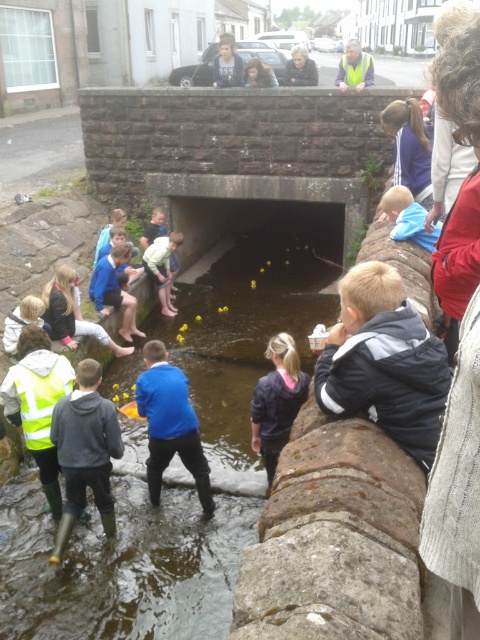
How distant is blue fabric jacket at center from yellow reflective vest at lower left?

34.67 inches

Can you confirm if blue fabric jacket at center is positioned to the left of yellow reflective vest at lower left?

In fact, blue fabric jacket at center is to the right of yellow reflective vest at lower left.

Which is in front, point (212, 500) or point (48, 396)?

Point (48, 396)

The height and width of the screenshot is (640, 480). In order to click on blue fabric jacket at center in this screenshot , I will do `click(169, 422)`.

Is yellow rubber ducks at center taller than matte black jacket at lower left?

Indeed, yellow rubber ducks at center has a greater height compared to matte black jacket at lower left.

Can you confirm if yellow rubber ducks at center is shorter than matte black jacket at lower left?

In fact, yellow rubber ducks at center may be taller than matte black jacket at lower left.

Who is more forward, (x=287, y=291) or (x=108, y=346)?

Point (x=108, y=346) is in front.

Locate an element on the screen. The width and height of the screenshot is (480, 640). yellow rubber ducks at center is located at coordinates (250, 323).

What do you see at coordinates (37, 403) in the screenshot? I see `yellow reflective vest at lower left` at bounding box center [37, 403].

Does yellow reflective vest at lower left appear over matte black jacket at upper center?

Incorrect, yellow reflective vest at lower left is not positioned above matte black jacket at upper center.

What do you see at coordinates (37, 403) in the screenshot? I see `yellow reflective vest at lower left` at bounding box center [37, 403].

Find the location of a particular element. The image size is (480, 640). yellow reflective vest at lower left is located at coordinates [37, 403].